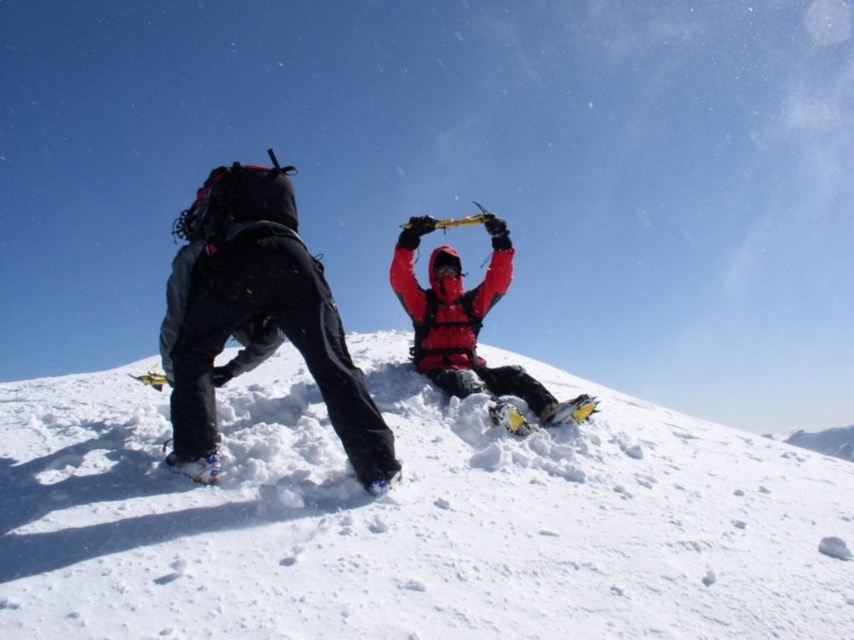
Question: Which object is positioned farthest from the matte red jacket at center?

Choices:
 (A) white fluffy snow at center
 (B) matte black pants at left

Answer: (A)

Question: Which point is farther to the camera?

Choices:
 (A) white fluffy snow at center
 (B) matte black pants at left

Answer: (A)

Question: Can you confirm if white fluffy snow at center is positioned below matte black pants at left?

Choices:
 (A) no
 (B) yes

Answer: (B)

Question: Does matte black pants at left appear on the right side of matte red jacket at center?

Choices:
 (A) no
 (B) yes

Answer: (A)

Question: Which of these objects is positioned closest to the matte black pants at left?

Choices:
 (A) matte red jacket at center
 (B) white fluffy snow at center

Answer: (B)

Question: Is white fluffy snow at center wider than matte red jacket at center?

Choices:
 (A) yes
 (B) no

Answer: (B)